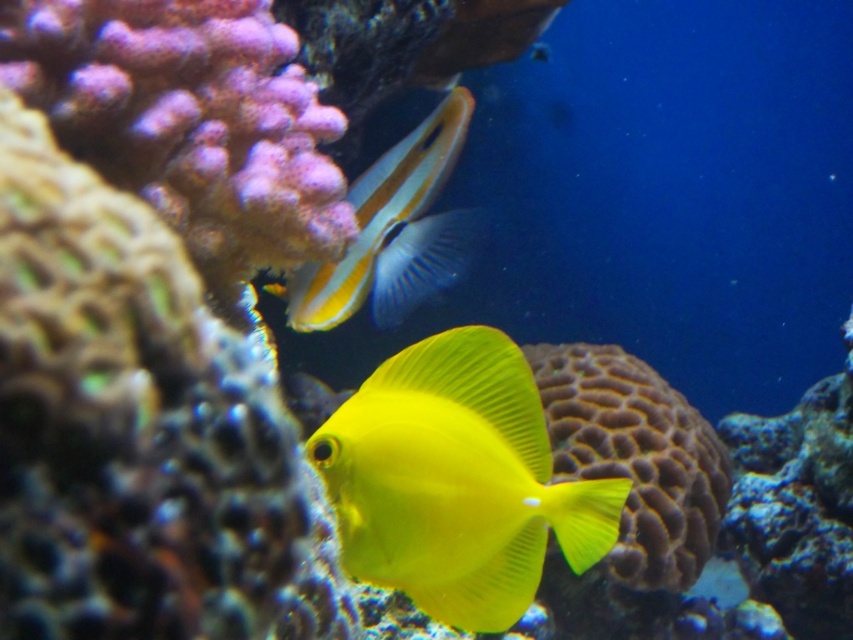
You are a marine biologist observing this underwater scene. You notice two yellow fish at the center. Which one is closer to you, the yellow matte fish at center or the shiny yellow fish at center?

The yellow matte fish at center is closer to the viewer than the shiny yellow fish at center.